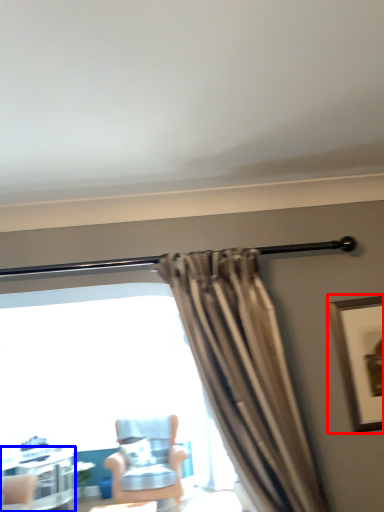
Question: Which object appears farthest to the camera in this image, picture frame (highlighted by a red box) or table (highlighted by a blue box)?

Choices:
 (A) picture frame
 (B) table

Answer: (B)